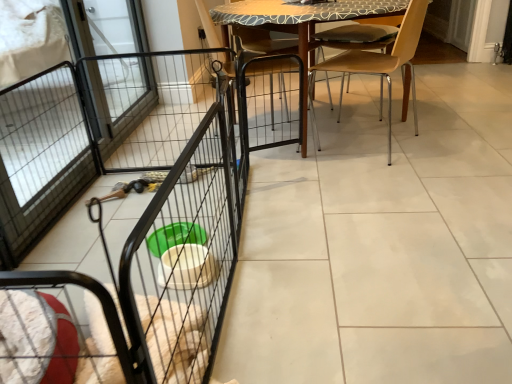
Question: Is wooden table at center oriented towards wooden chair at center?

Choices:
 (A) no
 (B) yes

Answer: (A)

Question: Is wooden table at center positioned with its back to wooden chair at center?

Choices:
 (A) yes
 (B) no

Answer: (A)

Question: Is wooden table at center at the left side of wooden chair at center?

Choices:
 (A) no
 (B) yes

Answer: (A)

Question: Is wooden table at center bigger than wooden chair at center?

Choices:
 (A) no
 (B) yes

Answer: (B)

Question: Does wooden table at center have a greater height compared to wooden chair at center?

Choices:
 (A) yes
 (B) no

Answer: (B)

Question: From the image's perspective, is wooden table at center above wooden chair at center?

Choices:
 (A) no
 (B) yes

Answer: (B)

Question: From the image's perspective, would you say black wire cage at center is shown under black wire screen door at left?

Choices:
 (A) yes
 (B) no

Answer: (A)

Question: Are black wire cage at center and black wire screen door at left located far from each other?

Choices:
 (A) no
 (B) yes

Answer: (B)

Question: Is the position of black wire cage at center more distant than that of black wire screen door at left?

Choices:
 (A) no
 (B) yes

Answer: (A)

Question: Is black wire cage at center completely or partially outside of black wire screen door at left?

Choices:
 (A) no
 (B) yes

Answer: (B)

Question: Is black wire cage at center shorter than black wire screen door at left?

Choices:
 (A) yes
 (B) no

Answer: (A)

Question: From a real-world perspective, is black wire cage at center physically below black wire screen door at left?

Choices:
 (A) yes
 (B) no

Answer: (A)

Question: From a real-world perspective, is black wire screen door at left positioned under light brown wood chair at center based on gravity?

Choices:
 (A) no
 (B) yes

Answer: (A)